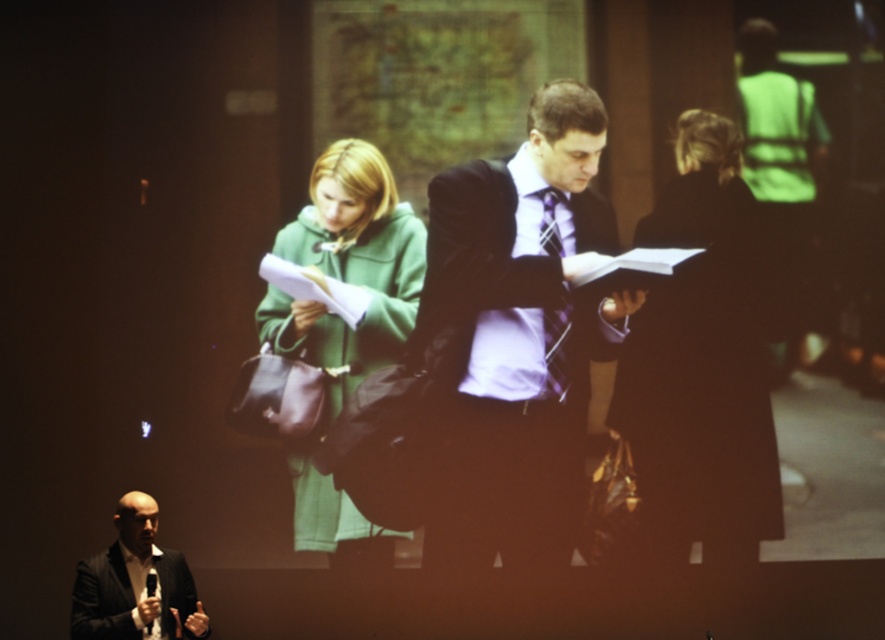
You are organizing a coat rack for a small event. You have two coats to hang up. The matte black coat at center and the green matte coat at center. Given the space available, which coat should you hang first to ensure both fit?

The matte black coat at center is bigger than the green matte coat at center. Therefore, you should hang the matte black coat at center first to ensure there is enough space for both coats.

Consider the image. You are standing at the center of the room and want to hand a document to the person wearing the matte black suit at lower left. In which direction should you move to reach them?

The matte black suit at lower left is located at point (135, 582), so you should move towards the lower left direction to reach them.